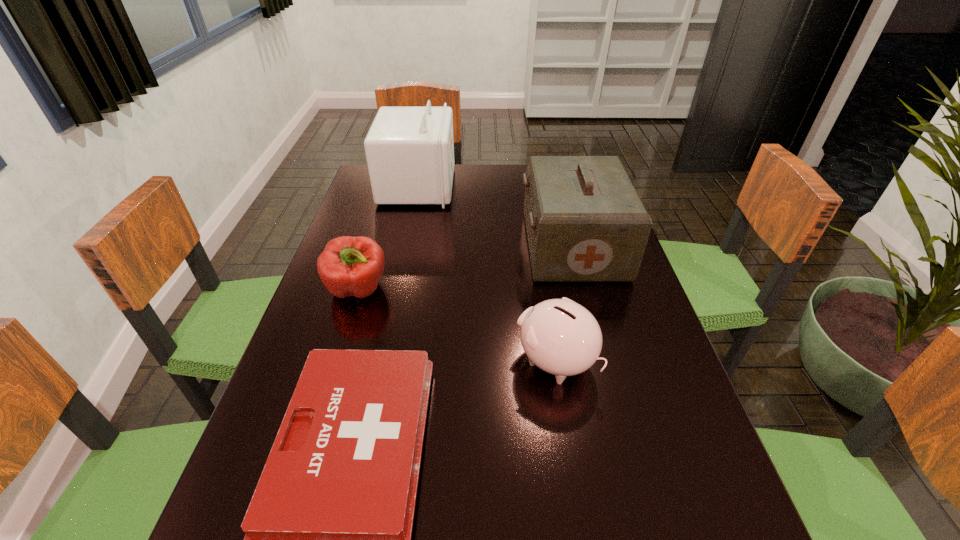
Locate an element on the screen. object that is at the far edge is located at coordinates (410, 150).

Where is `the first-aid kit that is at the left edge`? Image resolution: width=960 pixels, height=540 pixels. the first-aid kit that is at the left edge is located at coordinates (410, 150).

I want to click on bell pepper present at the left edge, so click(x=349, y=266).

Find the location of a particular element. This screenshot has height=540, width=960. the first-aid kit present at the right edge is located at coordinates (x=585, y=221).

Locate an element on the screen. The height and width of the screenshot is (540, 960). piggy bank that is at the right edge is located at coordinates (561, 337).

Locate an element on the screen. The image size is (960, 540). object positioned at the far left corner is located at coordinates (410, 150).

At what (x,y) coordinates should I click in order to perform the action: click on free spot at the far edge of the desktop. Please return your answer as a coordinate pair (x, y). Looking at the image, I should click on (504, 172).

In the image, there is a desktop. Identify the location of free space at the left edge. This screenshot has width=960, height=540. pos(373,312).

Locate an element on the screen. The width and height of the screenshot is (960, 540). blank area at the right edge is located at coordinates (670, 455).

The image size is (960, 540). Find the location of `unoccupied area between the piggy bank and the bell pepper`. unoccupied area between the piggy bank and the bell pepper is located at coordinates (457, 326).